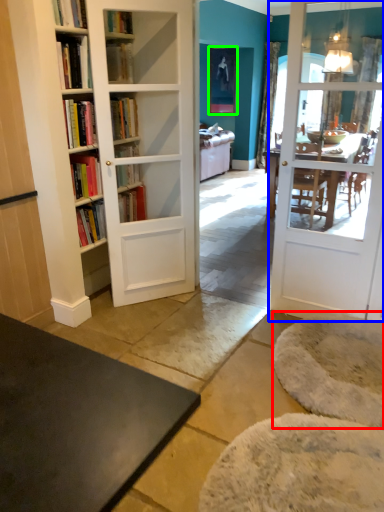
Question: Based on their relative distances, which object is nearer to yoga mat (highlighted by a red box)? Choose from door (highlighted by a blue box) and picture frame (highlighted by a green box).

Choices:
 (A) door
 (B) picture frame

Answer: (A)